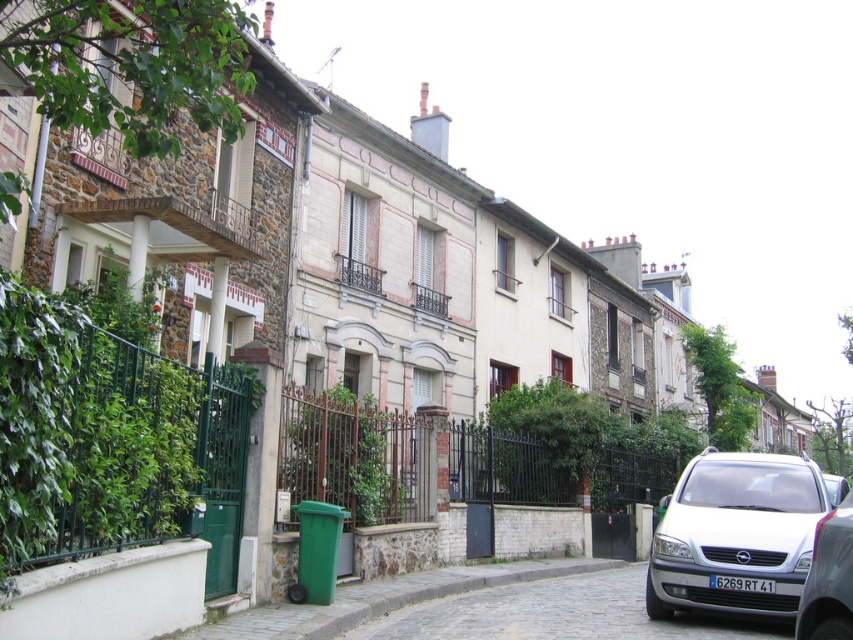
You are a delivery driver who needs to park your white matte van at lower right and silver metallic van at right in a tight alleyway. Which van should you park first to ensure both fit?

The white matte van at lower right is bigger than the silver metallic van at right, so you should park the white matte van at lower right first to accommodate its larger size before the smaller silver metallic van at right.